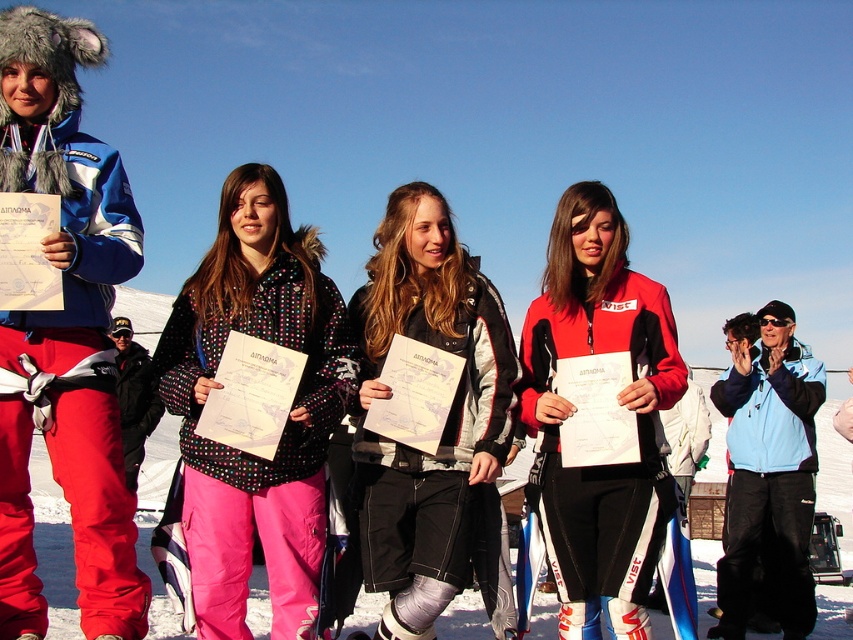
You are standing in the winter sports event scene and want to place a small flag exactly halfway between point (x=566, y=273) and point (x=204, y=269). Will the flag be closer to the front or the back of the image?

The flag placed halfway between point (x=566, y=273) and point (x=204, y=269) will be closer to the back of the image because point (x=566, y=273) is closer to the viewer than point (x=204, y=269), so the midpoint leans towards the farther point.

You are organizing a group photo for the winter sports event. The participants are wearing the matte blue jacket at left and the light blue fleece jacket at right. Since you want to ensure that all participants are visible in the photo, which jacket should be placed on the side where more space is needed due to its width?

→ The light blue fleece jacket at right requires more space because its width is greater than the matte blue jacket at left.

You are a photographer at the winter sports event. You need to take a photo of the matte blue jacket at left and the light blue fleece jacket at right. According to the scene description, which jacket is positioned to the left of the other?

The matte blue jacket at left is positioned to the left of the light blue fleece jacket at right.